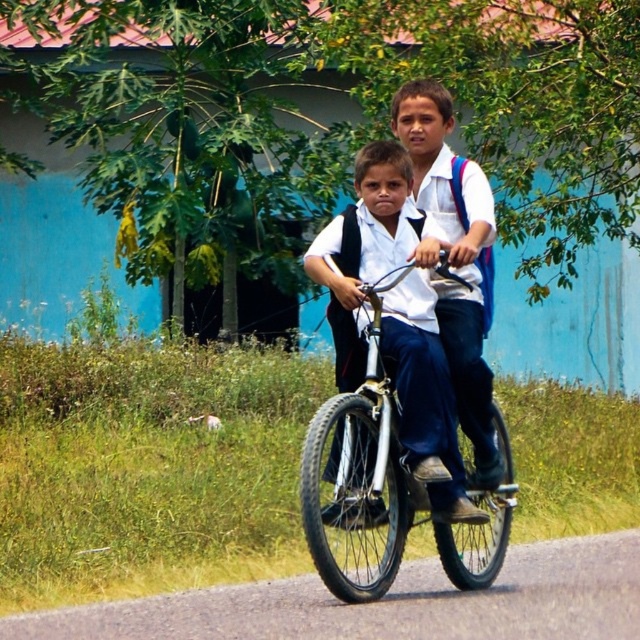
Find the location of a particular element. metallic silver bicycle at center is located at coordinates (362, 461).